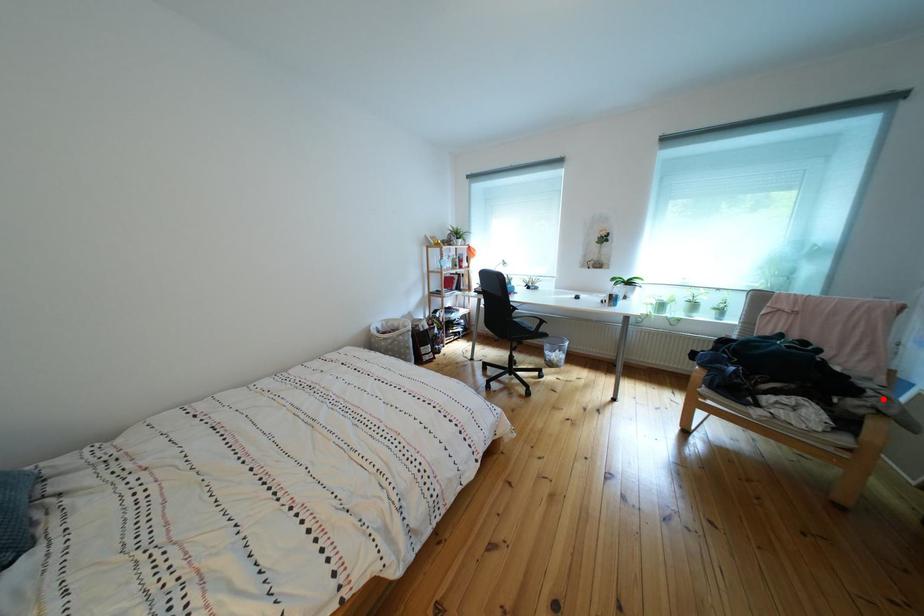
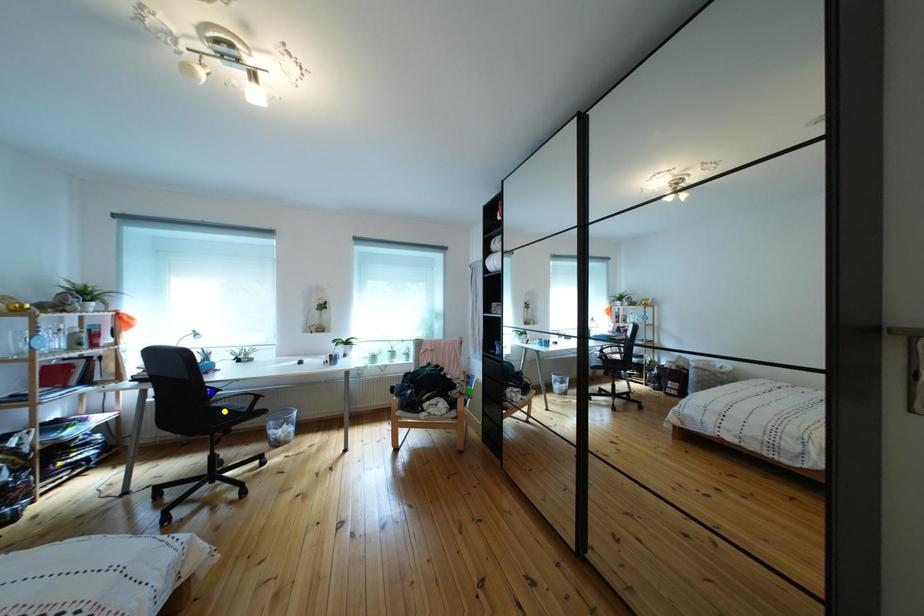
Question: I am providing you with two images of the same scene from different viewpoints. A red point is marked on the first image. You are given multiple points on the second image. Which point in image 2 is actually the same real-world point as the red point in image 1?

Choices:
 (A) blue point
 (B) yellow point
 (C) green point

Answer: (C)